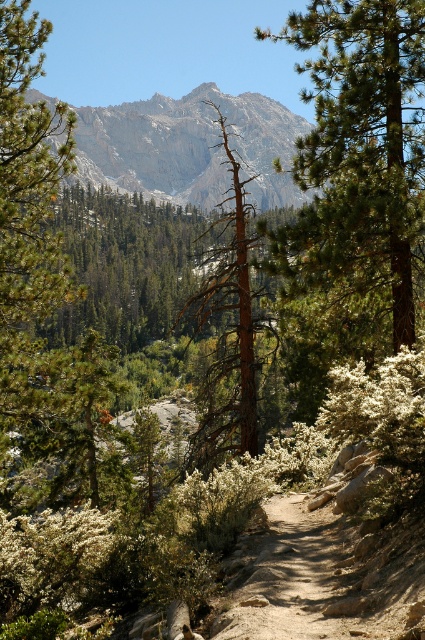
You are a hiker planning to follow the dirt path through the forest. You notice two points marked on your map at coordinates point (376, 204) and point (221, 428). According to the image, which point is closer to the starting point of the path?

Point (376, 204) is in front of point (221, 428), so the point (376, 204) is closer to the starting point of the path.

You are a hiker planning to take a photo of the rugged granite mountain at center from the dirt path in the foreground. Based on the scene description, can you determine if the mountain will be fully visible in your photo if you position yourself at the starting point of the path?

The rugged granite mountain at center is located at point [189,147], which suggests it is positioned centrally within the image frame. Since the dirt path is in the foreground and the mountain is at the center, the mountain should be fully visible in your photo when positioned at the path start.